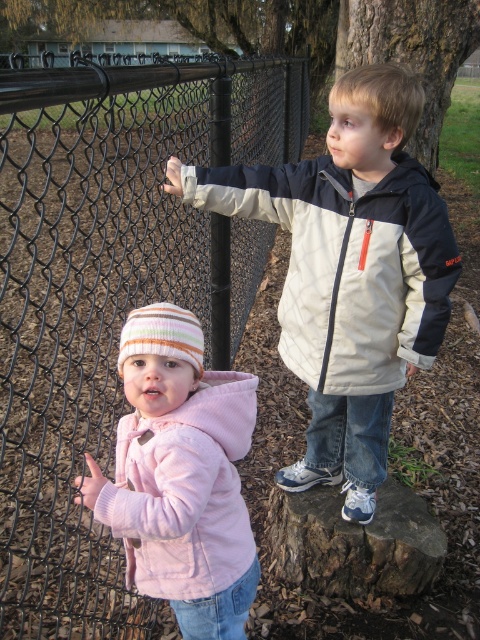
Question: Considering the relative positions of pink fleece jacket at lower left and brown rough tree stump at lower center in the image provided, where is pink fleece jacket at lower left located with respect to brown rough tree stump at lower center?

Choices:
 (A) right
 (B) left

Answer: (B)

Question: Which object is positioned closest to the brown rough tree stump at lower center?

Choices:
 (A) pink fleece jacket at lower left
 (B) black chain-link fence at left

Answer: (A)

Question: Does black chain-link fence at left have a greater width compared to brown rough tree stump at lower center?

Choices:
 (A) yes
 (B) no

Answer: (A)

Question: Is pink fleece jacket at lower left below brown rough tree stump at lower center?

Choices:
 (A) yes
 (B) no

Answer: (B)

Question: Which object is positioned farthest from the brown rough tree stump at lower center?

Choices:
 (A) light beige jacket at upper right
 (B) pink fleece jacket at lower left

Answer: (B)

Question: Considering the real-world distances, which object is farthest from the light beige jacket at upper right?

Choices:
 (A) pink fleece jacket at lower left
 (B) brown rough tree stump at lower center

Answer: (B)